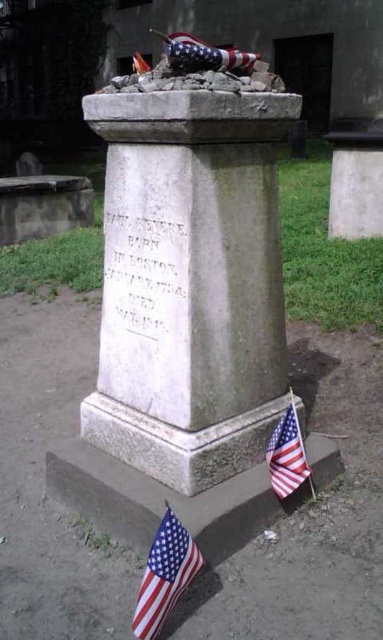
Question: Which of the following is the closest to the observer?

Choices:
 (A) red fabric flag at upper center
 (B) american flag at top
 (C) american flag at lower left
 (D) american flag at lower right

Answer: (C)

Question: Which point is farther from the camera taking this photo?

Choices:
 (A) (152, 634)
 (B) (157, 134)
 (C) (140, 65)
 (D) (178, 49)

Answer: (C)

Question: Which of these objects is positioned closest to the red fabric flag at upper center?

Choices:
 (A) american flag at lower left
 (B) white stone monument at center

Answer: (B)

Question: Observing the image, what is the correct spatial positioning of white stone monument at center in reference to red fabric flag at upper center?

Choices:
 (A) left
 (B) right

Answer: (B)

Question: Is american flag at lower left closer to camera compared to american flag at lower right?

Choices:
 (A) yes
 (B) no

Answer: (A)

Question: Can you confirm if white stone monument at center is smaller than american flag at top?

Choices:
 (A) yes
 (B) no

Answer: (A)